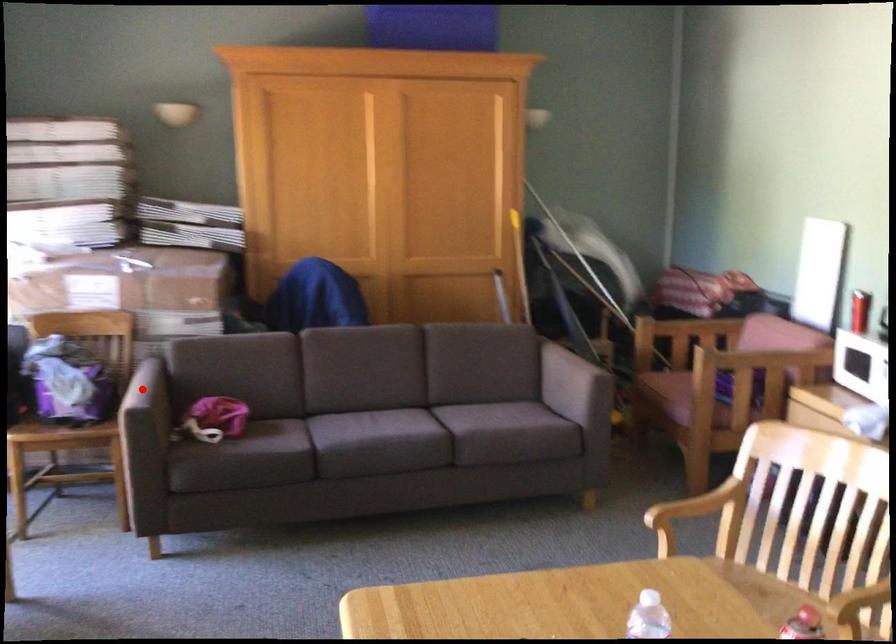
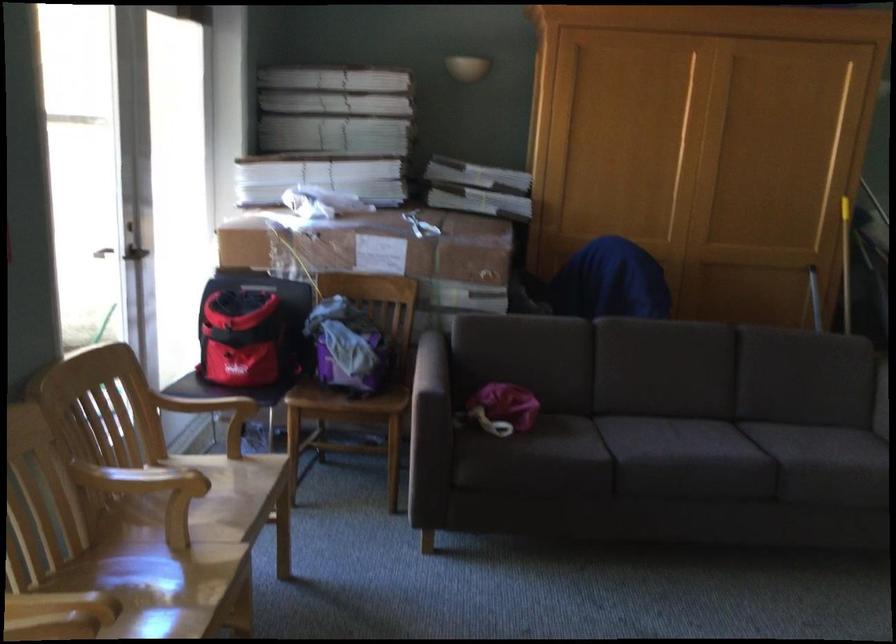
Find the pixel in the second image that matches the highlighted location in the first image.

(431, 365)